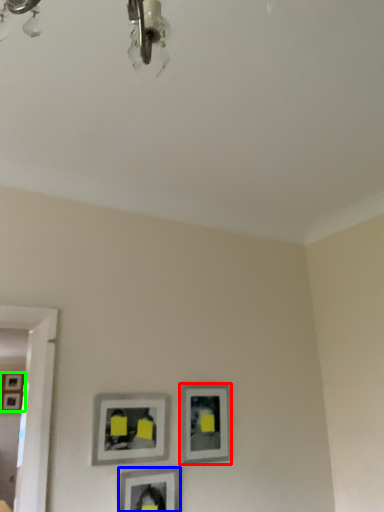
Question: Based on their relative distances, which object is nearer to picture frame (highlighted by a red box)? Choose from picture frame (highlighted by a blue box) and picture frame (highlighted by a green box).

Choices:
 (A) picture frame
 (B) picture frame

Answer: (A)